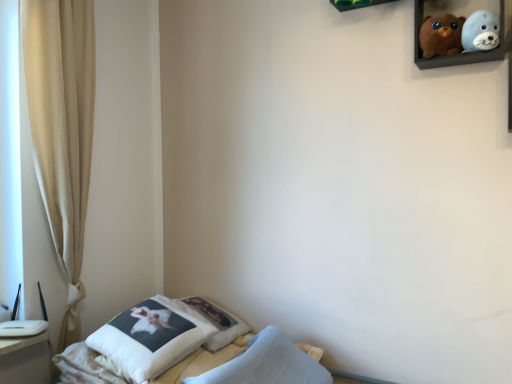
Question: Is white soft pillow at lower left bigger or smaller than wooden shelf at upper center?

Choices:
 (A) big
 (B) small

Answer: (A)

Question: In the image, is white soft pillow at lower left positioned in front of or behind wooden shelf at upper center?

Choices:
 (A) behind
 (B) front

Answer: (B)

Question: Estimate the real-world distances between objects in this image. Which object is farther from the velvet plush toys at upper right?

Choices:
 (A) soft plush seal at upper right, which is the 1th toy from right to left
 (B) white cotton pillow at lower center, marked as the second pillow in a front-to-back arrangement
 (C) white soft pillow at lower left, the first pillow from the front
 (D) transparent glass window at left
 (E) white soft pillow at lower left

Answer: (D)

Question: Which of these objects is positioned closest to the white soft pillow at lower left, the first pillow from the front?

Choices:
 (A) white soft pillow at lower left
 (B) wooden shelf at upper center
 (C) velvet plush toys at upper right
 (D) white cotton pillow at lower center, which appears as the first pillow when viewed from the back
 (E) soft plush seal at upper right, which is the 1th toy from right to left

Answer: (A)